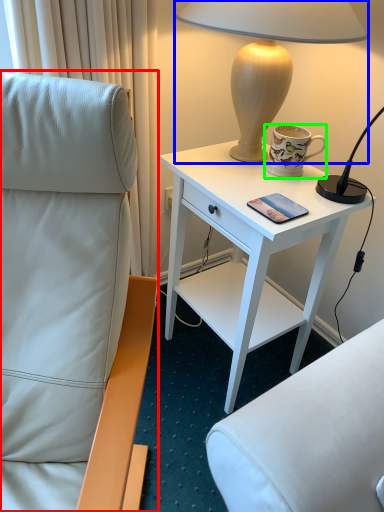
Question: Which object is positioned closest to chair (highlighted by a red box)? Select from lamp (highlighted by a blue box) and coffee cup (highlighted by a green box).

Choices:
 (A) lamp
 (B) coffee cup

Answer: (A)